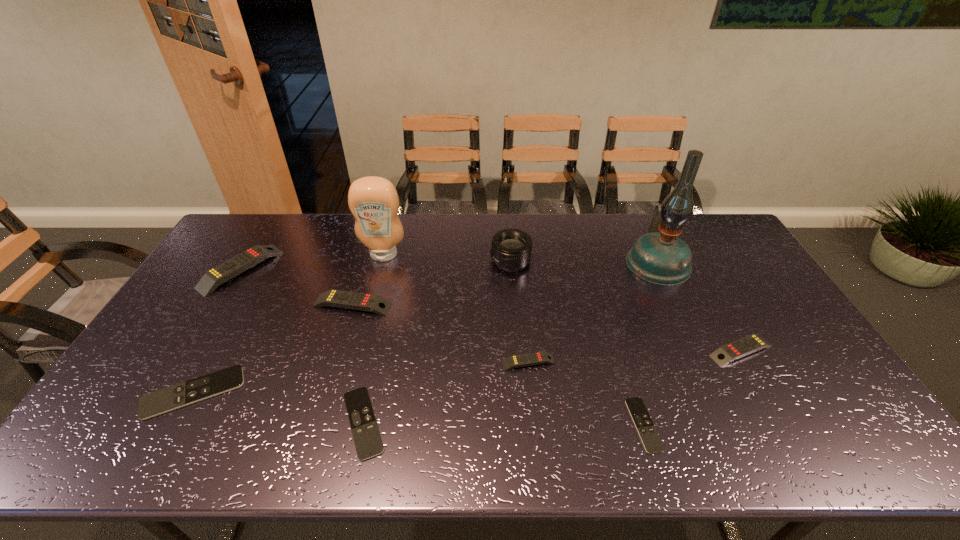
Where is `condiment that is positioned at the far edge`? This screenshot has height=540, width=960. condiment that is positioned at the far edge is located at coordinates (373, 201).

Locate an element on the screen. The image size is (960, 540). telephoto lens situated at the far edge is located at coordinates (511, 249).

Find the location of a particular element. Image resolution: width=960 pixels, height=540 pixels. remote control that is at the far edge is located at coordinates coord(218,275).

You are a GUI agent. You are given a task and a screenshot of the screen. Output one action in this format:
    pyautogui.click(x=<x>, y=<y>)
    Task: Click on the object present at the right edge
    The width and height of the screenshot is (960, 540).
    Given the screenshot: What is the action you would take?
    pyautogui.click(x=737, y=349)

The image size is (960, 540). In order to click on object that is at the far left corner in this screenshot , I will do `click(218, 275)`.

In the image, there is a desktop. Where is `vacant area at the far edge`? This screenshot has width=960, height=540. vacant area at the far edge is located at coordinates (559, 221).

Where is `vacant region at the near edge of the desktop`? The width and height of the screenshot is (960, 540). vacant region at the near edge of the desktop is located at coordinates (780, 444).

Where is `blank space at the left edge`? blank space at the left edge is located at coordinates (142, 372).

Locate an element on the screen. The width and height of the screenshot is (960, 540). vacant region at the right edge of the desktop is located at coordinates click(766, 308).

Image resolution: width=960 pixels, height=540 pixels. In order to click on free spot at the far right corner of the desktop in this screenshot , I will do `click(710, 244)`.